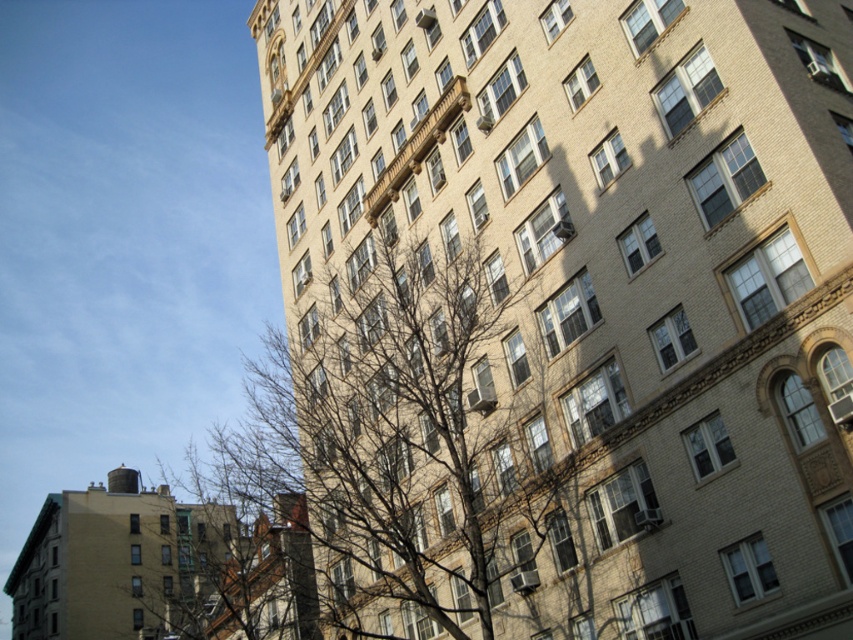
Question: Can you confirm if beige brick building at center is positioned above bare branches at left?

Choices:
 (A) yes
 (B) no

Answer: (A)

Question: Is the position of beige brick building at center less distant than that of bare branches at left?

Choices:
 (A) no
 (B) yes

Answer: (B)

Question: Does beige brick building at center have a greater width compared to bare branches at left?

Choices:
 (A) no
 (B) yes

Answer: (A)

Question: Which of the following is the farthest from the observer?

Choices:
 (A) beige brick building at center
 (B) bare branches at left

Answer: (B)

Question: Which point appears farthest from the camera in this image?

Choices:
 (A) (625, 516)
 (B) (679, 168)

Answer: (A)